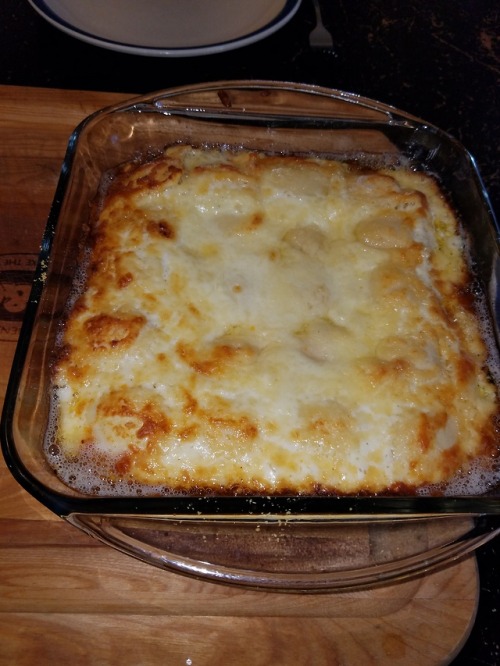
Image resolution: width=500 pixels, height=666 pixels. In order to click on plate in this screenshot , I will do `click(153, 18)`.